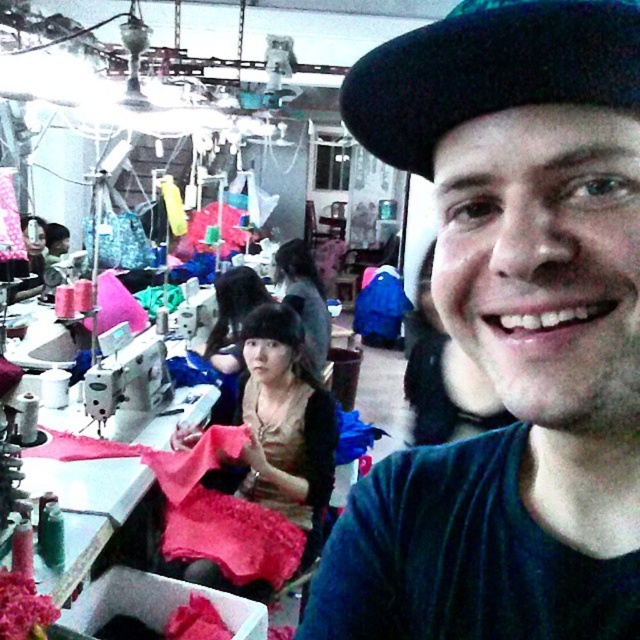
Can you confirm if black felt hat at upper center is bigger than metallic silver sewing machine at left?

No.

Is black felt hat at upper center below metallic silver sewing machine at left?

Actually, black felt hat at upper center is above metallic silver sewing machine at left.

What do you see at coordinates (490, 70) in the screenshot?
I see `black felt hat at upper center` at bounding box center [490, 70].

Where is `black felt hat at upper center`? Image resolution: width=640 pixels, height=640 pixels. black felt hat at upper center is located at coordinates (490, 70).

Is black felt hat at upper center thinner than matte pink fabric at center?

Yes.

Does point (408, 113) come in front of point (268, 499)?

Yes, point (408, 113) is in front of point (268, 499).

At what (x,y) coordinates should I click in order to perform the action: click on black felt hat at upper center. Please return your answer as a coordinate pair (x, y). The height and width of the screenshot is (640, 640). Looking at the image, I should click on (490, 70).

Does matte pink fabric at center have a smaller size compared to metallic silver sewing machine at left?

No.

Is point (204, 481) closer to camera compared to point (120, 369)?

No, it is behind (120, 369).

Where is `matte pink fabric at center`? This screenshot has width=640, height=640. matte pink fabric at center is located at coordinates (284, 426).